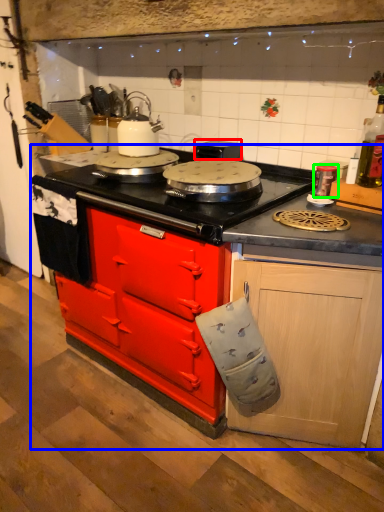
Question: Which object is the farthest from appliance (highlighted by a red box)? Choose among these: countertop (highlighted by a blue box) or kitchen appliance (highlighted by a green box).

Choices:
 (A) countertop
 (B) kitchen appliance

Answer: (A)